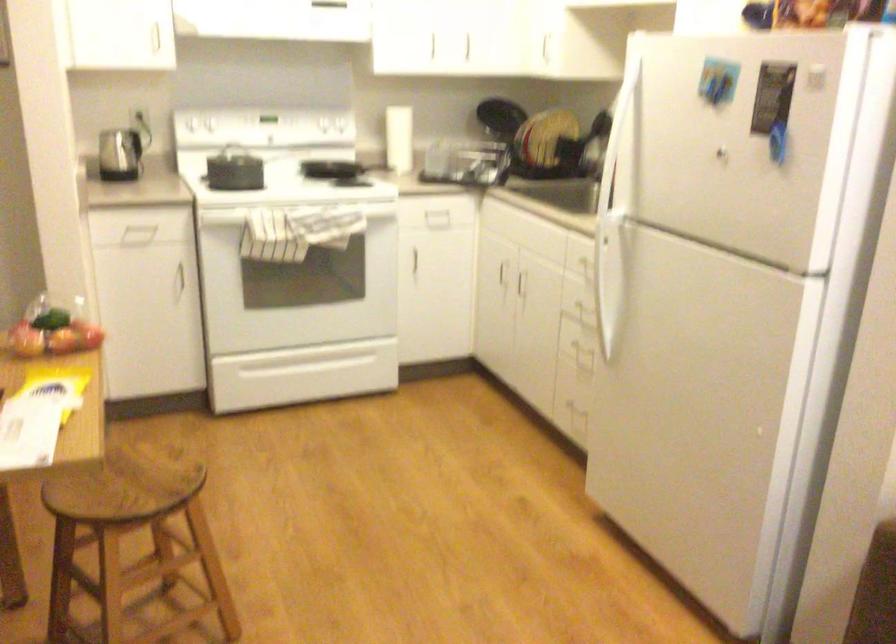
You are a GUI agent. You are given a task and a screenshot of the screen. Output one action in this format:
    pyautogui.click(x=<x>, y=<y>)
    Task: Click on the stool sitting surface
    This screenshot has height=644, width=896.
    Given the screenshot: What is the action you would take?
    132,540